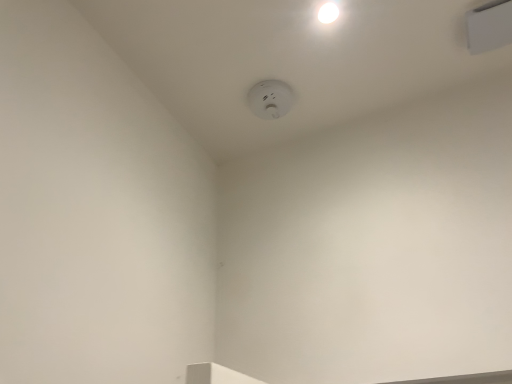
Describe the element at coordinates (270, 99) in the screenshot. Image resolution: width=512 pixels, height=384 pixels. I see `white plastic smoke detector at upper center` at that location.

Measure the distance between point (270, 116) and camera.

Point (270, 116) and camera are 4.95 feet apart from each other.

Identify the location of white plastic smoke detector at upper center. The width and height of the screenshot is (512, 384). (270, 99).

Where is `white plastic smoke detector at upper center`? This screenshot has width=512, height=384. white plastic smoke detector at upper center is located at coordinates (270, 99).